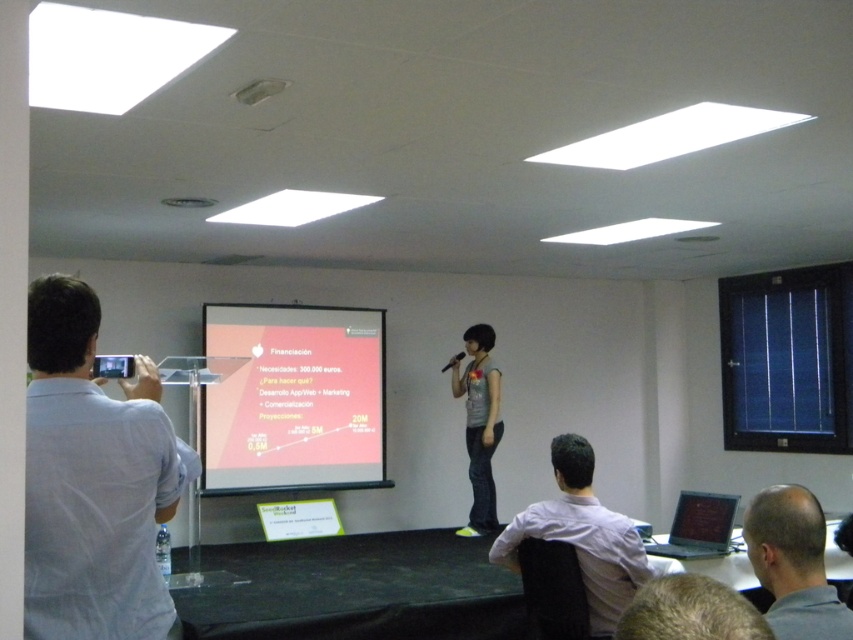
You are sitting in the audience and want to know which of the two points, point (764, 525) or point (477, 390), is closer to the presenter on stage. Based on their positions, which point is in front of the other?

Point (764, 525) is in front of point (477, 390), so it is closer to the presenter on stage.

Consider the image. You are sitting in the audience and want to see both the bald head at center and the matte gray shirt at center clearly. Which one is more likely to block your view of the other?

The bald head at center has a lesser height compared to matte gray shirt at center, so the matte gray shirt at center is taller and could potentially block the view of the bald head at center.

You are an event planner checking the setup for a presentation. You notice the matte orange projector screen at center and the bald head at center. Which object is wider?

The matte orange projector screen at center is wider than the bald head at center, as its width surpasses the bald head at center.